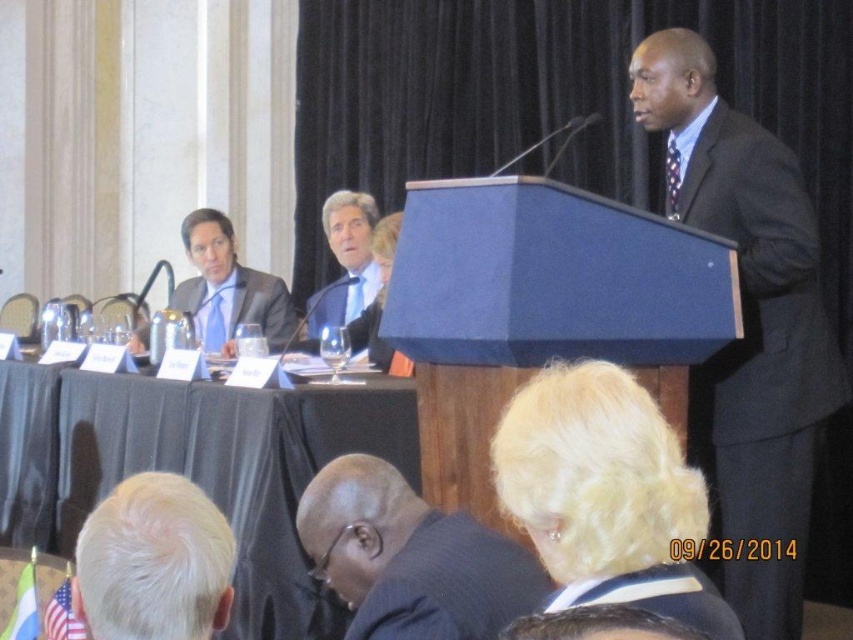
You are standing in the conference hall and want to approach the black fabric table at lower center. If your walking distance is limited to 10 feet, can you reach it without moving further than that?

The black fabric table at lower center is 10.54 feet away from viewer, so you cannot reach it within the 10 feet limit since it is slightly farther away.